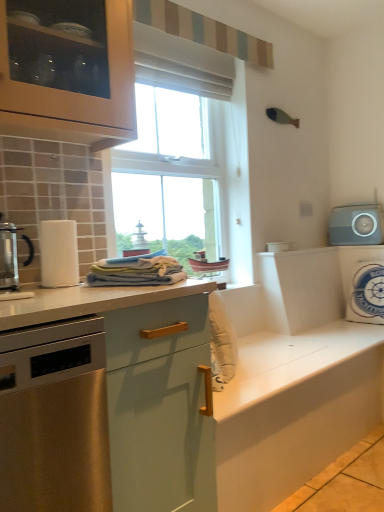
What is the approximate height of white matte cabinet at center?

white matte cabinet at center is 46.98 centimeters tall.

Describe the element at coordinates (363, 283) in the screenshot. Image resolution: width=384 pixels, height=512 pixels. I see `white fabric pillow at right, positioned as the 1th appliance in bottom-to-top order` at that location.

You are a GUI agent. You are given a task and a screenshot of the screen. Output one action in this format:
    pyautogui.click(x=<x>, y=<y>)
    Task: Click on the stainless steel dishwasher at left
    This screenshot has width=384, height=512.
    Given the screenshot: What is the action you would take?
    pyautogui.click(x=54, y=418)

Locate an element on the screen. The image size is (384, 512). gray matte speaker at upper right, positioned as the first appliance in top-to-bottom order is located at coordinates (356, 225).

Image resolution: width=384 pixels, height=512 pixels. Describe the element at coordinates (356, 225) in the screenshot. I see `gray matte speaker at upper right, which is the third appliance from bottom to top` at that location.

Locate an element on the screen. This screenshot has width=384, height=512. white matte cabinet at center is located at coordinates (294, 410).

From a real-world perspective, is matte white countertop at center on gray matte speaker at upper right, which is the third appliance from bottom to top?

Actually, matte white countertop at center is physically below gray matte speaker at upper right, which is the third appliance from bottom to top, in the real world.

Who is shorter, matte white countertop at center or gray matte speaker at upper right, which is the 1th appliance in right-to-left order?

gray matte speaker at upper right, which is the 1th appliance in right-to-left order.

Considering the positions of points (66, 316) and (334, 243), is point (66, 316) closer to camera compared to point (334, 243)?

Yes, point (66, 316) is closer to viewer.

From the image's perspective, is matte white countertop at center positioned above or below gray matte speaker at upper right, which ranks as the third appliance in left-to-right order?

Based on their image positions, matte white countertop at center is located beneath gray matte speaker at upper right, which ranks as the third appliance in left-to-right order.

Which is behind, point (356, 252) or point (188, 281)?

The point (356, 252) is behind.

From the image's perspective, between white fabric pillow at right, positioned as the 1th appliance in bottom-to-top order, and matte white countertop at center, which one is located above?

From the image's view, white fabric pillow at right, positioned as the 1th appliance in bottom-to-top order, is above.

In the image, is white fabric pillow at right, the second appliance positioned from the left, on the left side or the right side of matte white countertop at center?

white fabric pillow at right, the second appliance positioned from the left, is to the right of matte white countertop at center.

From a real-world perspective, is white fabric pillow at right, positioned as the 2th appliance in right-to-left order, physically below matte white countertop at center?

No, from a real-world perspective, white fabric pillow at right, positioned as the 2th appliance in right-to-left order, is not below matte white countertop at center.

In the scene shown: From a real-world perspective, is matte white countertop at center below white plastic container at upper right, the first appliance from the left?

Yes.

From the image's perspective, between matte white countertop at center and white plastic container at upper right, the first appliance from the left, which one is located above?

white plastic container at upper right, the first appliance from the left.

Between matte white countertop at center and white plastic container at upper right, the first appliance from the left, which one has less height?

Standing shorter between the two is white plastic container at upper right, the first appliance from the left.

Between matte white countertop at center and white plastic container at upper right, marked as the third appliance in a right-to-left arrangement, which one has smaller size?

With smaller size is white plastic container at upper right, marked as the third appliance in a right-to-left arrangement.

Consider the image. From the image's perspective, is white fabric pillow at right, which appears as the third appliance when viewed from the top, above stainless steel dishwasher at left?

Correct, white fabric pillow at right, which appears as the third appliance when viewed from the top, appears higher than stainless steel dishwasher at left in the image.

Considering the relative positions of white fabric pillow at right, the second appliance positioned from the left, and stainless steel dishwasher at left in the image provided, is white fabric pillow at right, the second appliance positioned from the left, to the right of stainless steel dishwasher at left from the viewer's perspective?

Yes, white fabric pillow at right, the second appliance positioned from the left, is to the right of stainless steel dishwasher at left.

From a real-world perspective, is white fabric pillow at right, the second appliance positioned from the left, on top of stainless steel dishwasher at left?

Correct, in the physical world, white fabric pillow at right, the second appliance positioned from the left, is higher than stainless steel dishwasher at left.

Which is more to the right, white fabric pillow at right, which appears as the third appliance when viewed from the top, or white plastic container at upper right, the 2th appliance from the bottom?

white fabric pillow at right, which appears as the third appliance when viewed from the top, is more to the right.

Are white fabric pillow at right, positioned as the 1th appliance in bottom-to-top order, and white plastic container at upper right, the first appliance from the left, far apart?

Actually, white fabric pillow at right, positioned as the 1th appliance in bottom-to-top order, and white plastic container at upper right, the first appliance from the left, are a little close together.

Does white fabric pillow at right, positioned as the 2th appliance in right-to-left order, have a greater width compared to white plastic container at upper right, the 2th appliance from the top?

Yes, white fabric pillow at right, positioned as the 2th appliance in right-to-left order, is wider than white plastic container at upper right, the 2th appliance from the top.

Is white plastic container at upper right, the 2th appliance from the top, taller or shorter than white fabric pillow at right, the second appliance positioned from the left?

In the image, white plastic container at upper right, the 2th appliance from the top, appears to be shorter than white fabric pillow at right, the second appliance positioned from the left.

Based on the photo, is white plastic container at upper right, the first appliance from the left, situated inside white fabric pillow at right, which appears as the third appliance when viewed from the top, or outside?

white plastic container at upper right, the first appliance from the left, is not inside white fabric pillow at right, which appears as the third appliance when viewed from the top, it's outside.

Consider the image. From a real-world perspective, is white plastic container at upper right, the 2th appliance from the top, beneath white fabric pillow at right, which appears as the third appliance when viewed from the top?

Incorrect, from a real-world perspective, white plastic container at upper right, the 2th appliance from the top, is higher than white fabric pillow at right, which appears as the third appliance when viewed from the top.

Looking at this image, considering the relative positions of white plastic container at upper right, the first appliance from the left, and white fabric pillow at right, positioned as the 1th appliance in bottom-to-top order, in the image provided, is white plastic container at upper right, the first appliance from the left, behind white fabric pillow at right, positioned as the 1th appliance in bottom-to-top order,?

No, white plastic container at upper right, the first appliance from the left, is closer to the camera.

In the scene shown: Considering the positions of objects stainless steel dishwasher at left and white matte cabinet at center in the image provided, who is more to the right, stainless steel dishwasher at left or white matte cabinet at center?

From the viewer's perspective, white matte cabinet at center appears more on the right side.

From the image's perspective, which object appears higher, stainless steel dishwasher at left or white matte cabinet at center?

stainless steel dishwasher at left, from the image's perspective.

Considering the sizes of objects stainless steel dishwasher at left and white matte cabinet at center in the image provided, who is smaller, stainless steel dishwasher at left or white matte cabinet at center?

Smaller between the two is stainless steel dishwasher at left.

Could white matte cabinet at center be considered to be inside stainless steel dishwasher at left?

Definitely not — white matte cabinet at center is not inside stainless steel dishwasher at left.

Locate an element on the screen. This screenshot has height=512, width=384. countertop on the left of gray matte speaker at upper right, which ranks as the third appliance in left-to-right order is located at coordinates (216, 399).

Find the location of a particular element. This screenshot has width=384, height=512. countertop below the white fabric pillow at right, which appears as the third appliance when viewed from the top (from the image's perspective) is located at coordinates (216, 399).

Estimate the real-world distances between objects in this image. Which object is closer to white plastic container at upper right, the 2th appliance from the bottom, metallic glass coffee maker at left or white matte cabinet at center?

white matte cabinet at center lies closer to white plastic container at upper right, the 2th appliance from the bottom, than the other object.

Based on their spatial positions, is white plastic container at upper right, the 2th appliance from the bottom, or white matte cabinet at center further from white fabric pillow at right, positioned as the 1th appliance in bottom-to-top order?

white matte cabinet at center is further to white fabric pillow at right, positioned as the 1th appliance in bottom-to-top order.

Which object lies nearer to the anchor point matte white countertop at center, white fabric pillow at right, the second appliance positioned from the left, or white matte cabinet at center?

Based on the image, white matte cabinet at center appears to be nearer to matte white countertop at center.

Looking at the image, which one is located closer to white matte cabinet at center, white plastic container at upper right, marked as the third appliance in a right-to-left arrangement, or matte white countertop at center?

matte white countertop at center lies closer to white matte cabinet at center than the other object.

Based on their spatial positions, is metallic glass coffee maker at left or white plastic container at upper right, the first appliance from the left, closer to gray matte speaker at upper right, which is the 1th appliance in right-to-left order?

white plastic container at upper right, the first appliance from the left.

Considering their positions, is gray matte speaker at upper right, which is the 1th appliance in right-to-left order, positioned further to metallic glass coffee maker at left than white plastic container at upper right, the first appliance from the left?

The object further to metallic glass coffee maker at left is gray matte speaker at upper right, which is the 1th appliance in right-to-left order.

Considering their positions, is white matte cabinet at center positioned closer to white fabric pillow at right, positioned as the 2th appliance in right-to-left order, than white plastic container at upper right, the first appliance from the left?

white plastic container at upper right, the first appliance from the left, is positioned closer to the anchor white fabric pillow at right, positioned as the 2th appliance in right-to-left order.

Based on their spatial positions, is white fabric pillow at right, positioned as the 1th appliance in bottom-to-top order, or stainless steel dishwasher at left closer to metallic glass coffee maker at left?

stainless steel dishwasher at left lies closer to metallic glass coffee maker at left than the other object.

Find the location of a particular element. home appliance between metallic glass coffee maker at left and white matte cabinet at center in the horizontal direction is located at coordinates (54, 418).

The width and height of the screenshot is (384, 512). I want to click on cabinetry positioned between stainless steel dishwasher at left and white fabric pillow at right, which appears as the third appliance when viewed from the top, from near to far, so point(294,410).

Locate an element on the screen. cabinetry between matte white countertop at center and gray matte speaker at upper right, positioned as the first appliance in top-to-bottom order, from front to back is located at coordinates (294, 410).

This screenshot has width=384, height=512. In order to click on countertop positioned between stainless steel dishwasher at left and white fabric pillow at right, the second appliance positioned from the left, from near to far in this screenshot , I will do `click(216, 399)`.